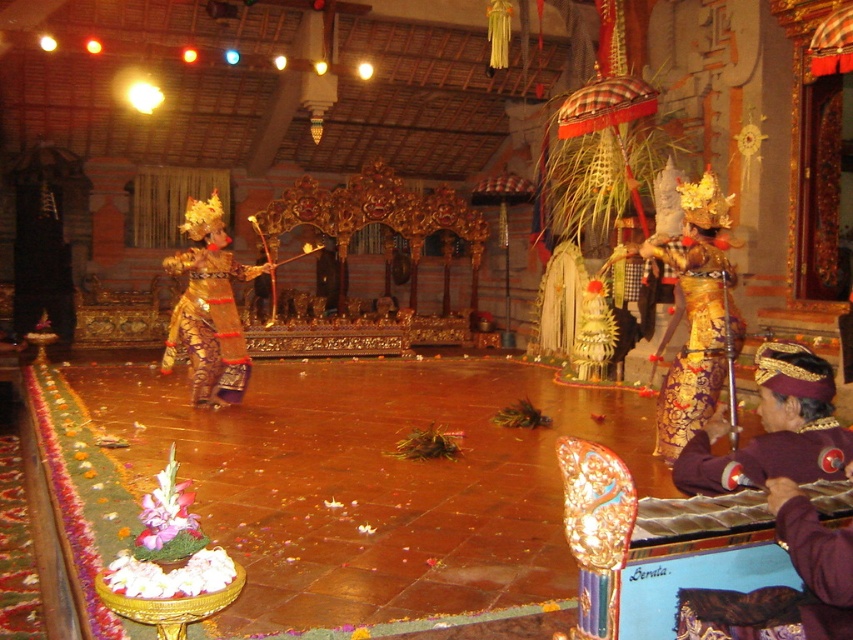
Question: Is purple velvet hat at lower right to the right of gold textured costume at center from the viewer's perspective?

Choices:
 (A) no
 (B) yes

Answer: (B)

Question: Is gold brocade costume at center bigger than purple velvet gloves at lower right?

Choices:
 (A) yes
 (B) no

Answer: (A)

Question: Which of the following is the farthest from the observer?

Choices:
 (A) gold textured costume at center
 (B) purple velvet gloves at lower right
 (C) gold brocade costume at center

Answer: (A)

Question: Among these objects, which one is nearest to the camera?

Choices:
 (A) gold textured costume at center
 (B) gold brocade costume at center

Answer: (B)

Question: Where is purple velvet hat at lower right located in relation to gold textured costume at center in the image?

Choices:
 (A) left
 (B) right

Answer: (B)

Question: Considering the real-world distances, which object is farthest from the gold textured costume at center?

Choices:
 (A) purple velvet gloves at lower right
 (B) gold brocade costume at center
 (C) purple velvet hat at lower right

Answer: (A)